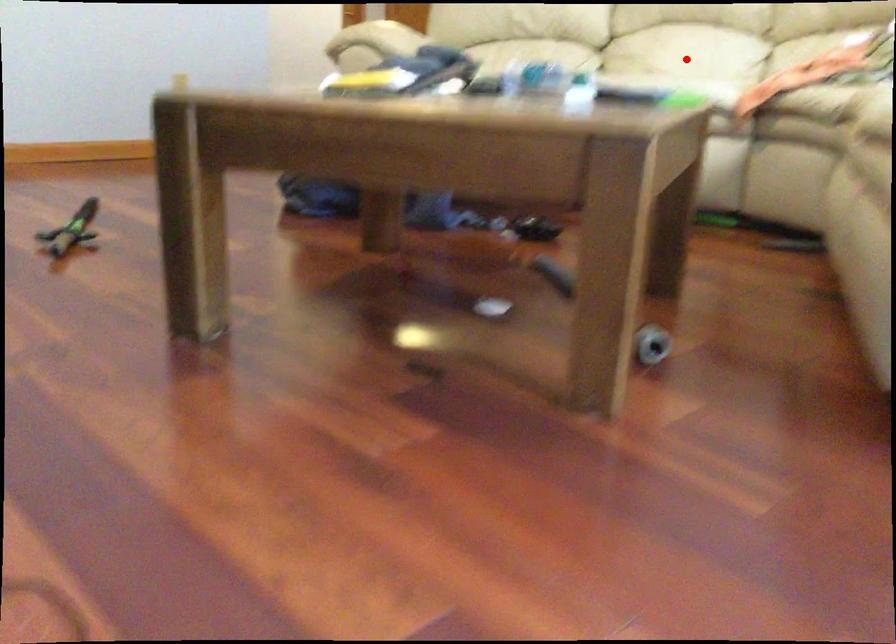
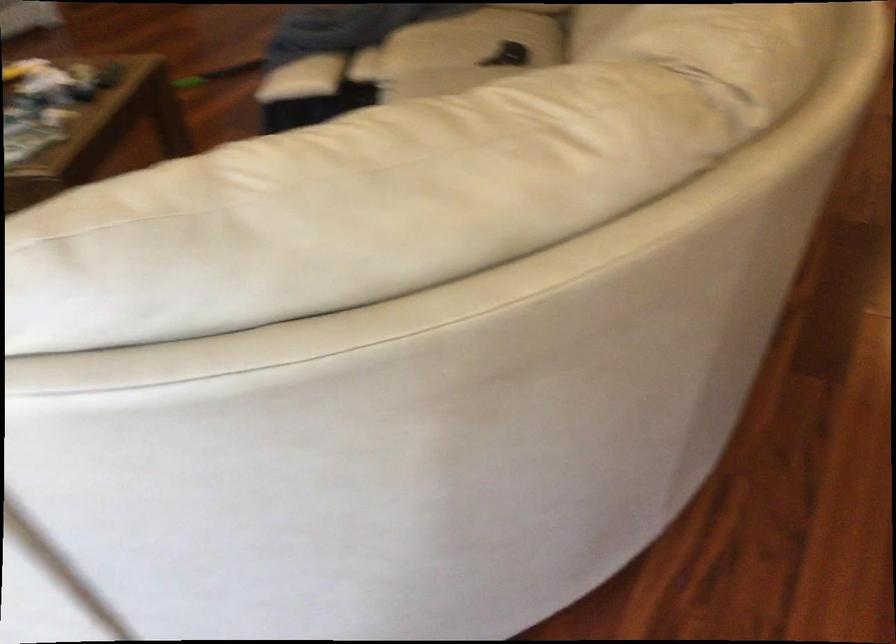
Question: I am providing you with two images of the same scene from different viewpoints. A red point is marked on the first image. Is the red point's position out of view in image 2?

Choices:
 (A) Yes
 (B) No

Answer: (A)